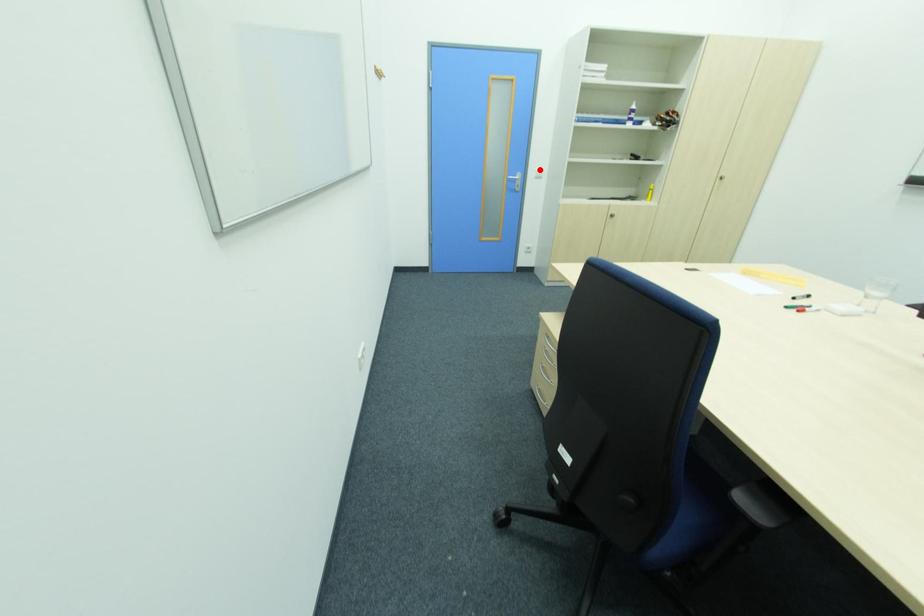
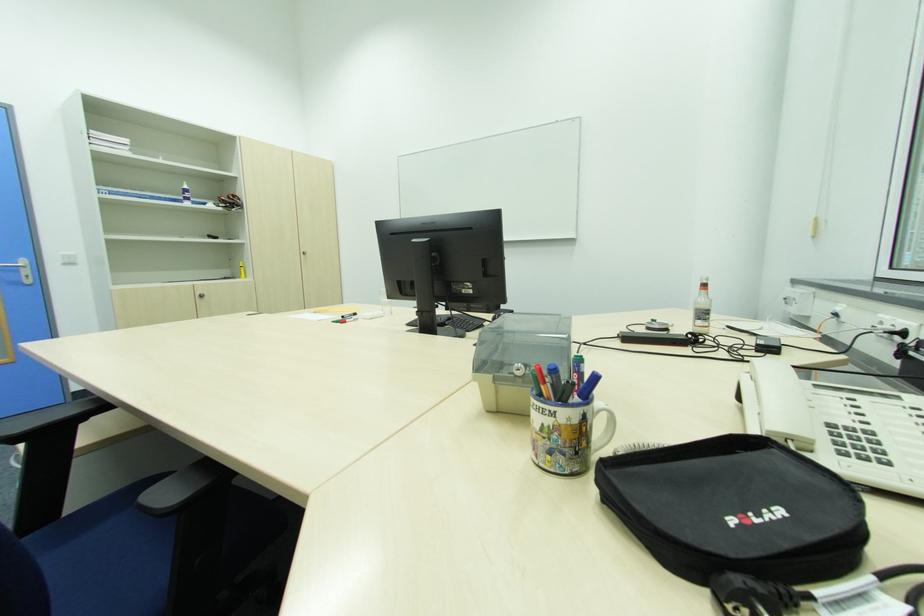
Where in the second image is the point corresponding to the highlighted location from the first image?

(64, 254)